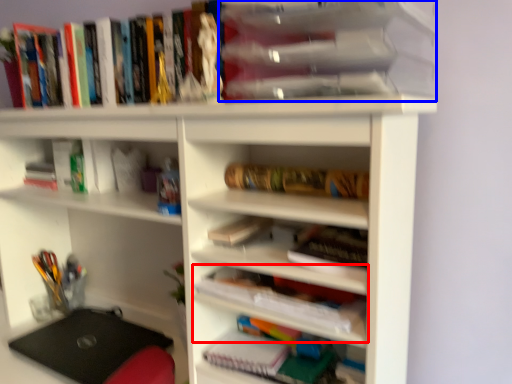
Question: Which point is closer to the camera, book (highlighted by a red box) or book (highlighted by a blue box)?

Choices:
 (A) book
 (B) book

Answer: (B)